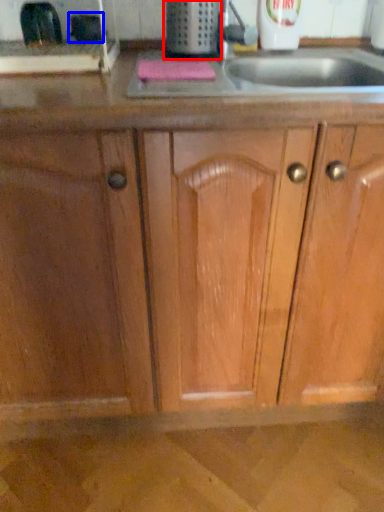
Question: Which object appears farthest to the camera in this image, appliance (highlighted by a red box) or appliance (highlighted by a blue box)?

Choices:
 (A) appliance
 (B) appliance

Answer: (B)